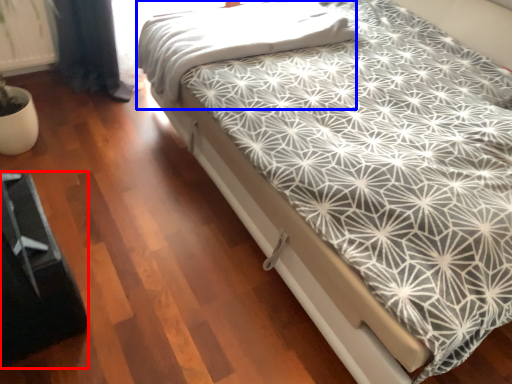
Question: Which object is further to the camera taking this photo, bed frame (highlighted by a red box) or blanket (highlighted by a blue box)?

Choices:
 (A) bed frame
 (B) blanket

Answer: (B)